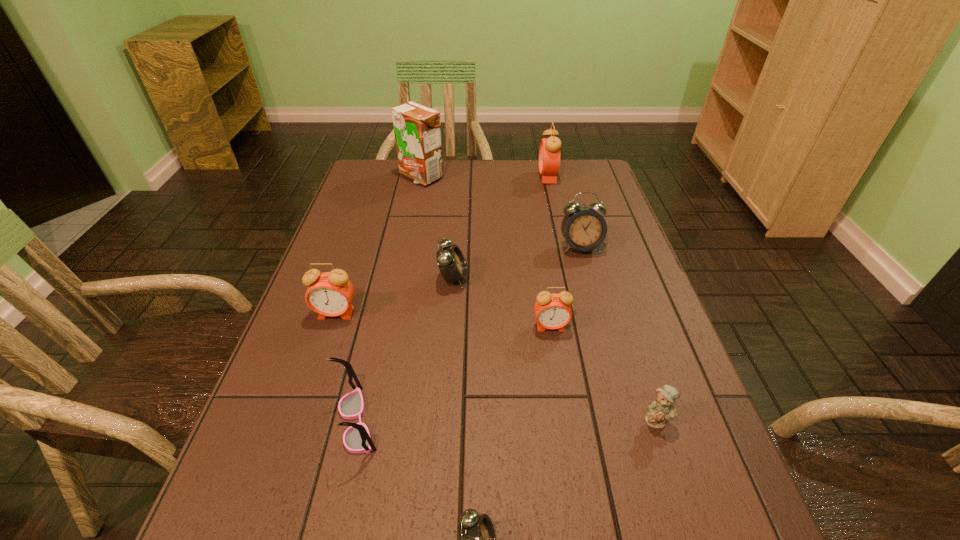
This screenshot has height=540, width=960. Identify the location of the tallest object. (417, 128).

You are a GUI agent. You are given a task and a screenshot of the screen. Output one action in this format:
    pyautogui.click(x=<x>, y=<y>)
    Task: Click on the eighth shortest object
    The image size is (960, 540).
    Given the screenshot: What is the action you would take?
    pyautogui.click(x=549, y=153)

At what (x,y) coordinates should I click in order to perform the action: click on the farthest alarm clock. Please return your answer as a coordinate pair (x, y). Looking at the image, I should click on (549, 153).

Find the location of `the rightmost white alarm clock`. the rightmost white alarm clock is located at coordinates (584, 229).

Where is `the biggest white alarm clock`? This screenshot has height=540, width=960. the biggest white alarm clock is located at coordinates (584, 229).

You are a GUI agent. You are given a task and a screenshot of the screen. Output one action in this format:
    pyautogui.click(x=<x>, y=<y>)
    Task: Click on the leftmost alarm clock
    This screenshot has height=540, width=960.
    Given the screenshot: What is the action you would take?
    pyautogui.click(x=330, y=294)

Where is `the leftmost pink alarm clock`? The width and height of the screenshot is (960, 540). the leftmost pink alarm clock is located at coordinates (330, 294).

Locate an element on the screen. This screenshot has width=960, height=540. the second nearest white alarm clock is located at coordinates (451, 262).

This screenshot has height=540, width=960. Identify the location of the fourth nearest alarm clock. (451, 262).

The height and width of the screenshot is (540, 960). What are the coordinates of `the smallest pink alarm clock` in the screenshot? It's located at (553, 311).